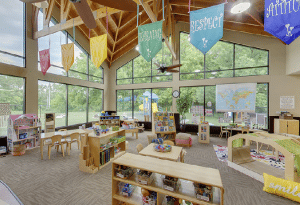
Image resolution: width=300 pixels, height=205 pixels. In order to click on table in this screenshot , I will do `click(172, 156)`, `click(65, 133)`, `click(237, 130)`.